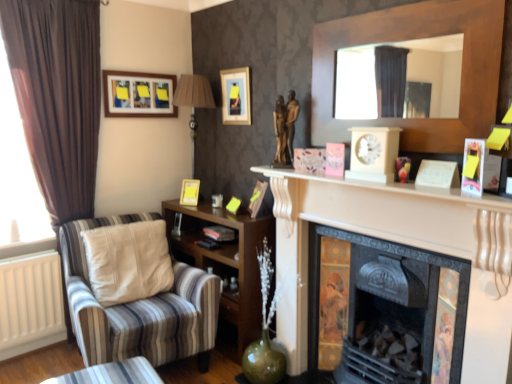
Question: Is metallic silver lamp at upper center taller or shorter than brown fabric curtain at left?

Choices:
 (A) tall
 (B) short

Answer: (B)

Question: From the image's perspective, is metallic silver lamp at upper center positioned above or below brown fabric curtain at left?

Choices:
 (A) below
 (B) above

Answer: (B)

Question: Which object is the farthest from the metallic ornate fireplace at center, the 1th fireplace viewed from the right?

Choices:
 (A) brown fabric curtain at left
 (B) matte wooden picture frame at upper left, the 1th picture frame in the left-to-right sequence
 (C) striped fabric armchair at left
 (D) white glossy fireplace at center, placed as the first fireplace when sorted from left to right
 (E) wooden shelf at lower left

Answer: (B)

Question: Which object is the farthest from the bronze statue at center?

Choices:
 (A) brown fabric curtain at left
 (B) striped fabric armchair at left
 (C) matte wooden picture frame at upper left, which ranks as the 3th picture frame in right-to-left order
 (D) wooden shelf at lower left
 (E) metallic silver lamp at upper center

Answer: (A)